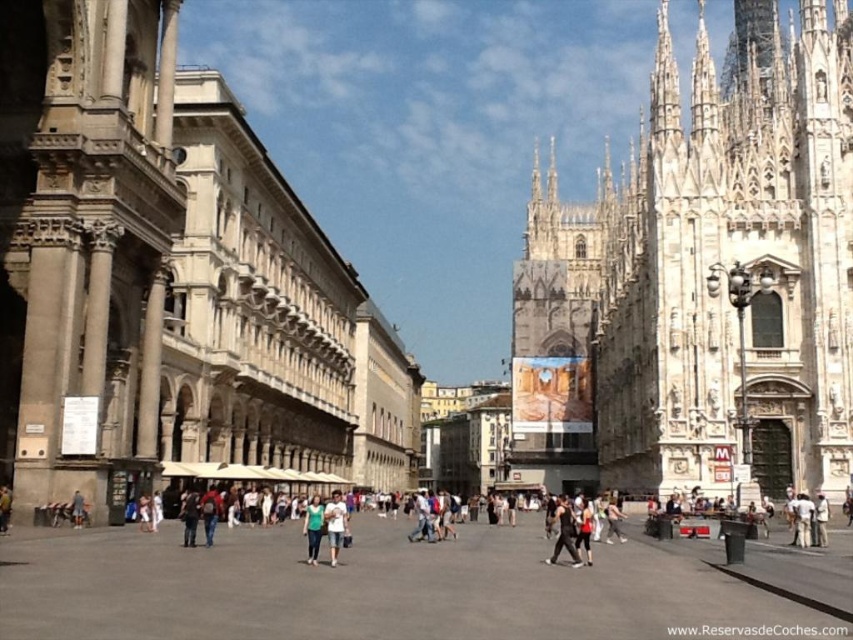
Question: Which object appears farthest from the camera in this image?

Choices:
 (A) concrete plaza at center
 (B) denim jeans at center
 (C) light blue denim shorts at center
 (D) white stone church at upper right

Answer: (D)

Question: Estimate the real-world distances between objects in this image. Which object is farther from the white stone church at center?

Choices:
 (A) light blue denim shorts at center
 (B) denim jeans at center
 (C) white stone church at upper right
 (D) green fabric shirt at center

Answer: (C)

Question: Is white stone church at center below white stone church at upper right?

Choices:
 (A) yes
 (B) no

Answer: (A)

Question: Considering the real-world distances, which object is closest to the white stone church at upper right?

Choices:
 (A) green fabric shirt at center
 (B) concrete plaza at center
 (C) white stone church at center
 (D) denim jeans at center

Answer: (C)

Question: Does white stone church at upper right appear under denim jeans at center?

Choices:
 (A) no
 (B) yes

Answer: (A)

Question: Is white stone church at center in front of light blue denim shorts at center?

Choices:
 (A) no
 (B) yes

Answer: (A)